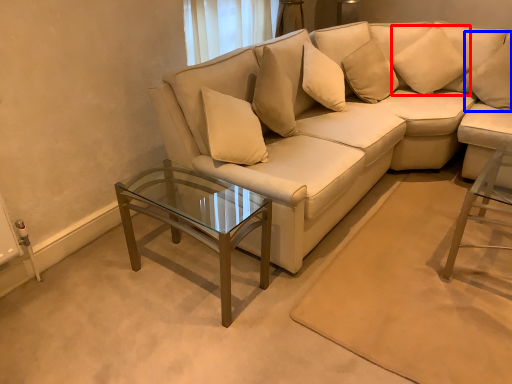
Question: Which object is closer to the camera taking this photo, pillow (highlighted by a red box) or pillow (highlighted by a blue box)?

Choices:
 (A) pillow
 (B) pillow

Answer: (B)